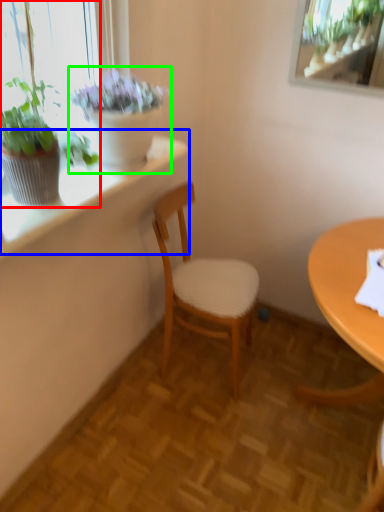
Question: Considering the real-world distances, which object is closest to houseplant (highlighted by a red box)? window sill (highlighted by a blue box) or houseplant (highlighted by a green box).

Choices:
 (A) window sill
 (B) houseplant

Answer: (B)